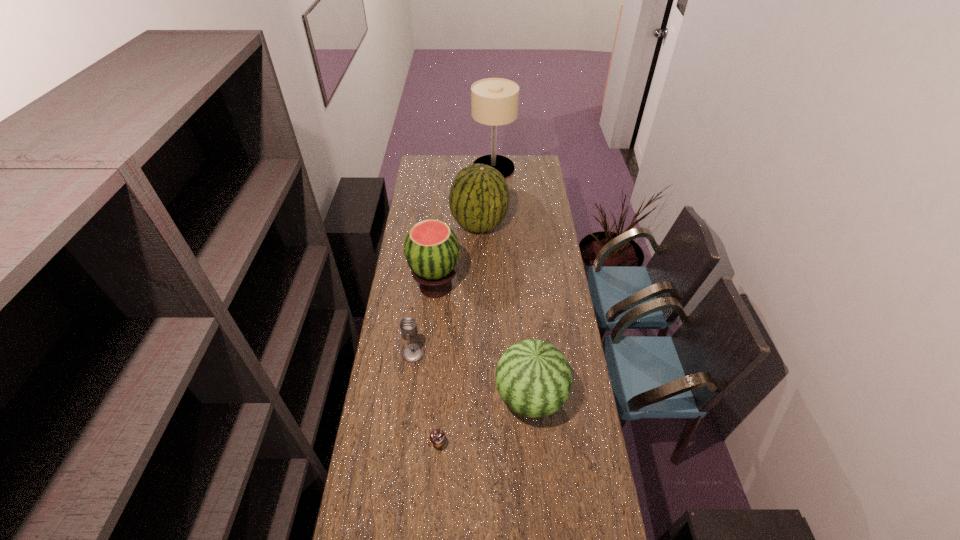
Where is `vacant space at the right edge of the desktop`? The height and width of the screenshot is (540, 960). vacant space at the right edge of the desktop is located at coordinates (541, 241).

Locate an element on the screen. Image resolution: width=960 pixels, height=540 pixels. free space between the second farthest object and the second nearest object is located at coordinates (505, 311).

This screenshot has width=960, height=540. Find the location of `free space between the second nearest object and the farthest watermelon`. free space between the second nearest object and the farthest watermelon is located at coordinates (505, 311).

Locate an element on the screen. The width and height of the screenshot is (960, 540). free space that is in between the farthest object and the second nearest object is located at coordinates (512, 282).

The height and width of the screenshot is (540, 960). In order to click on free area in between the farthest watermelon and the nearest watermelon in this screenshot , I will do `click(505, 311)`.

The height and width of the screenshot is (540, 960). Find the location of `free point between the shortest object and the tallest object`. free point between the shortest object and the tallest object is located at coordinates (466, 306).

The width and height of the screenshot is (960, 540). I want to click on empty space between the shortest object and the second shortest object, so click(426, 399).

This screenshot has width=960, height=540. Find the location of `free space between the third farthest object and the nearest object`. free space between the third farthest object and the nearest object is located at coordinates (437, 365).

Where is `object that is the fifth closest to the tallest object`? The height and width of the screenshot is (540, 960). object that is the fifth closest to the tallest object is located at coordinates (437, 436).

Where is `object that is the third closest to the fifth farthest object`? object that is the third closest to the fifth farthest object is located at coordinates (431, 248).